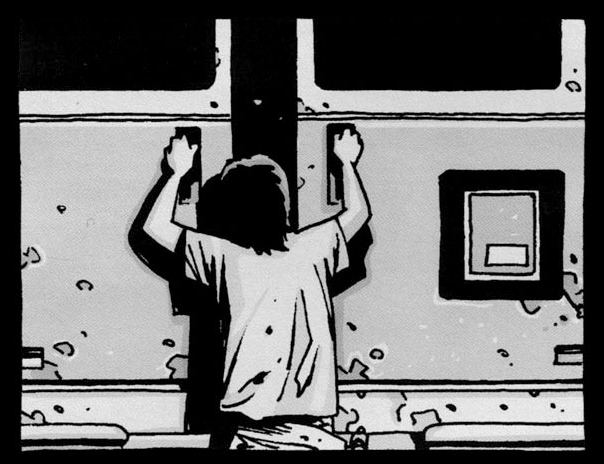
The image size is (604, 464). In order to click on window in this screenshot , I will do `click(374, 66)`, `click(159, 66)`.